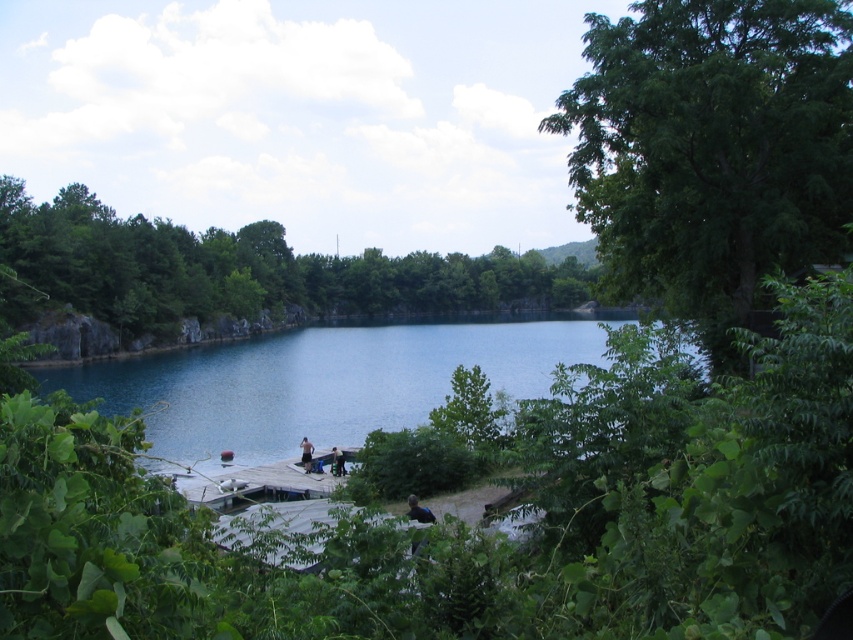
You are standing at the edge of the lake and want to reach the wooden dock at center. Based on the coordinates provided, in which direction should you walk to reach it?

The wooden dock at center is located at coordinates point [256,483]. Since the x coordinate is 0.756, which is to the right of the center point, you should walk towards the right to reach it.

You are standing at the point labeled point (287,432) on the dock. You want to reach a boat that is 212.05 feet away from you. Is the boat within a safe distance for you to swim to it?

The boat is 212.05 feet away from the point labeled point (287,432) on the dock. Swimming such a long distance could be dangerous, so it is not recommended to attempt it without proper safety measures.

You are standing on the wooden dock at center and want to jump into the blue water at center. Is the water deep enough for a safe jump? Please explain your reasoning based on the scene description.

The blue water at center is much taller than the wooden dock at center, which suggests that the water depth is significant. Since the water is deeper than the dock, jumping into it should be safe as there is enough depth to avoid hitting the bottom.